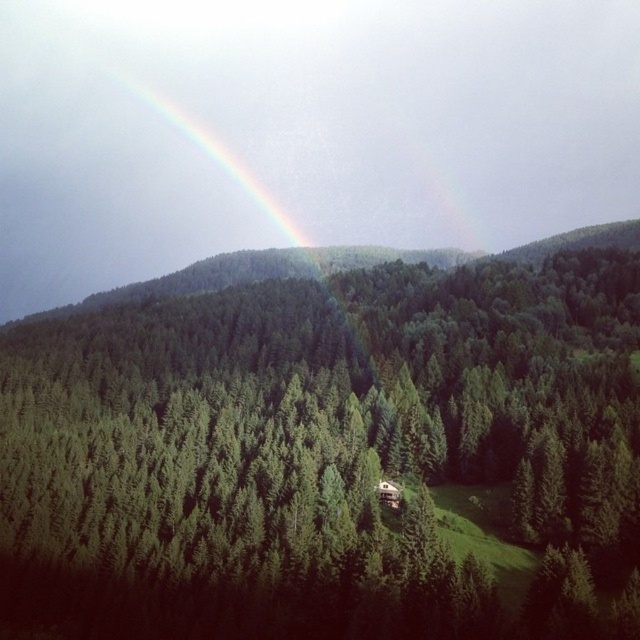
Question: Is green matte tree at center positioned before rainbow at upper center?

Choices:
 (A) yes
 (B) no

Answer: (A)

Question: Among these objects, which one is farthest from the camera?

Choices:
 (A) green matte tree at center
 (B) rainbow at upper center

Answer: (B)

Question: Observing the image, what is the correct spatial positioning of green matte tree at center in reference to rainbow at upper center?

Choices:
 (A) below
 (B) above

Answer: (A)

Question: Which point is closer to the camera?

Choices:
 (A) (468, 449)
 (B) (234, 212)

Answer: (A)

Question: From the image, what is the correct spatial relationship of green matte tree at center in relation to rainbow at upper center?

Choices:
 (A) above
 (B) below

Answer: (B)

Question: Which of the following is the farthest from the observer?

Choices:
 (A) (218, 161)
 (B) (305, 589)

Answer: (A)